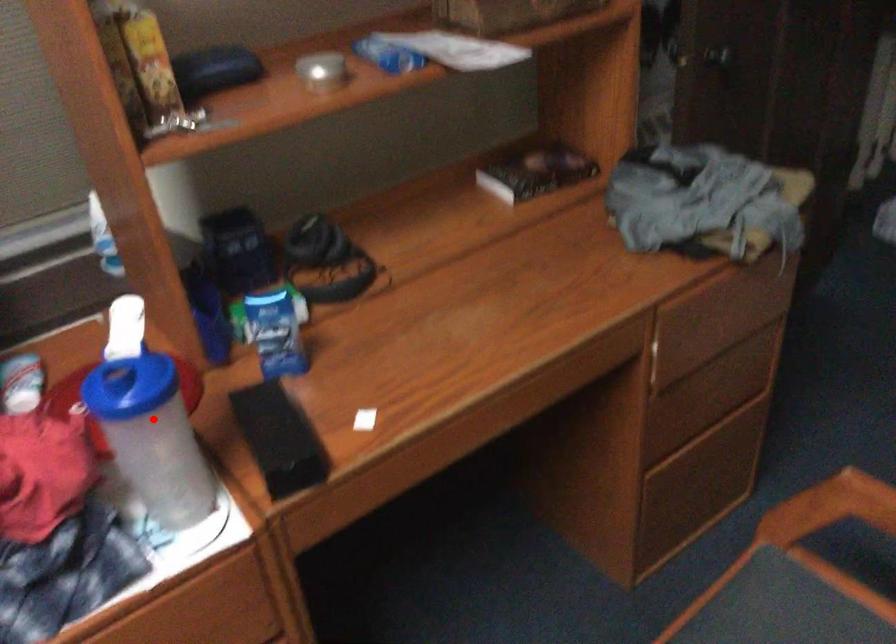
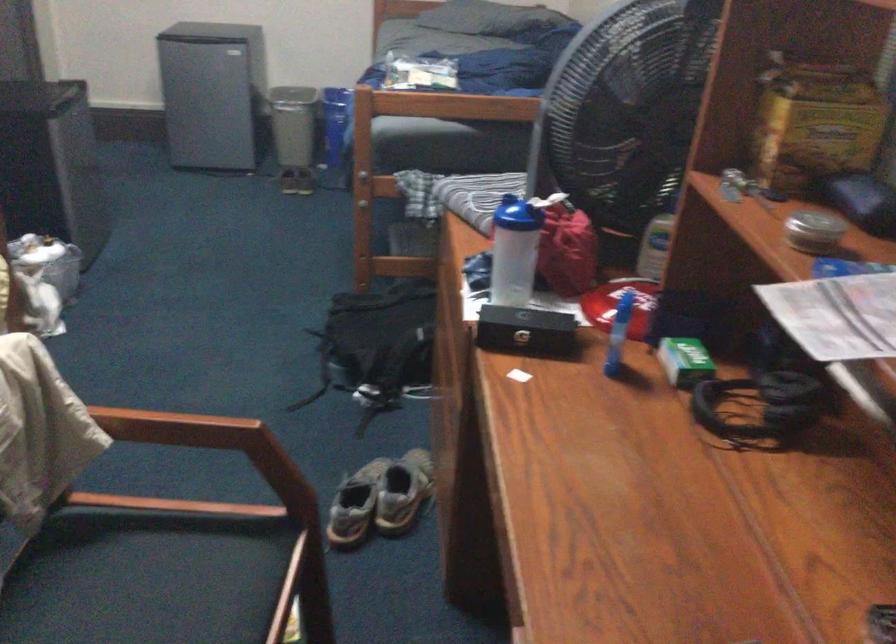
The point at the highlighted location is marked in the first image. Where is the corresponding point in the second image?

(513, 251)